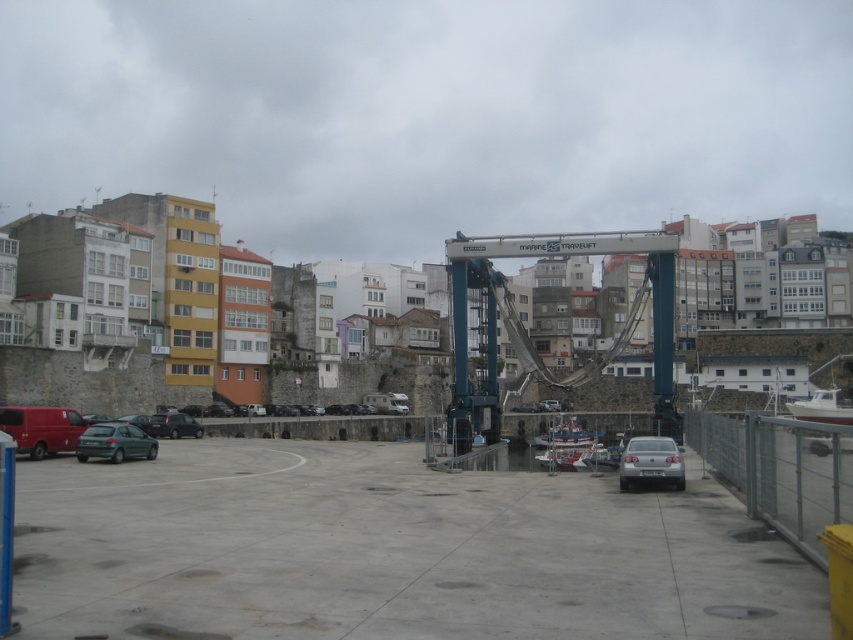
Between blue metallic crane at center and matte black car at lower left, which one appears on the right side from the viewer's perspective?

From the viewer's perspective, blue metallic crane at center appears more on the right side.

Is blue metallic crane at center wider than matte black car at lower left?

Yes.

Does point (671, 396) come behind point (195, 428)?

No, it is in front of (195, 428).

This screenshot has width=853, height=640. Find the location of `blue metallic crane at center`. blue metallic crane at center is located at coordinates (529, 337).

Is point (593, 600) positioned after point (173, 433)?

No, it is in front of (173, 433).

Is gray concrete parking lot at center shorter than matte black car at lower left?

Yes.

Which is behind, point (280, 490) or point (195, 420)?

Point (195, 420)

At what (x,y) coordinates should I click in order to perform the action: click on gray concrete parking lot at center. Please return your answer as a coordinate pair (x, y). Looking at the image, I should click on (389, 552).

Is blue metallic crane at center positioned in front of silver metallic car at lower right?

No.

Looking at this image, does blue metallic crane at center appear on the right side of silver metallic car at lower right?

Correct, you'll find blue metallic crane at center to the right of silver metallic car at lower right.

The width and height of the screenshot is (853, 640). In order to click on blue metallic crane at center in this screenshot , I will do `click(529, 337)`.